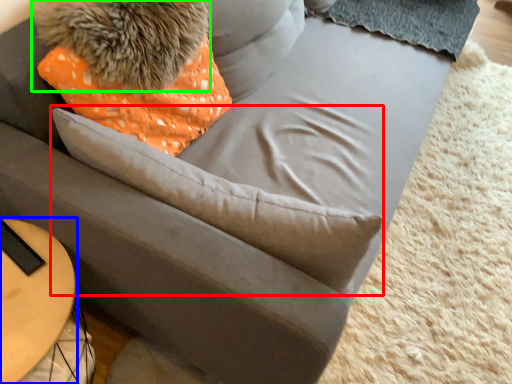
Question: Which object is positioned closest to throw pillow (highlighted by a red box)? Select from table (highlighted by a blue box) and animal (highlighted by a green box).

Choices:
 (A) table
 (B) animal

Answer: (B)